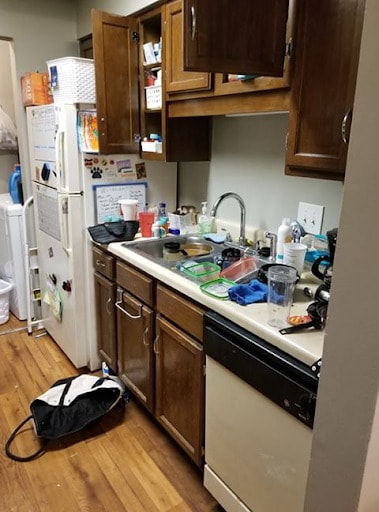
What are the coordinates of `laundry basket` in the screenshot? It's located at pyautogui.click(x=4, y=295).